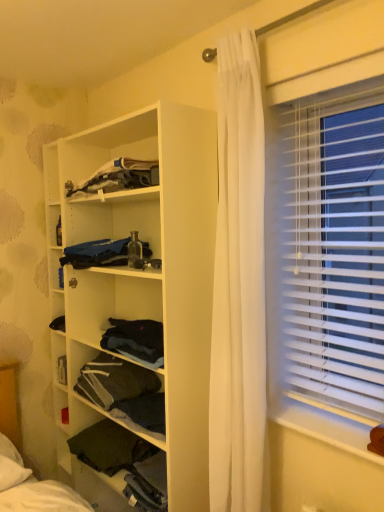
Question: Is white plastic window sill at lower right taller than dark fabric at lower left, which ranks as the 3th shelf in top-to-bottom order?

Choices:
 (A) yes
 (B) no

Answer: (B)

Question: Are white plastic window sill at lower right and dark fabric at lower left, the first shelf from the bottom, located far from each other?

Choices:
 (A) no
 (B) yes

Answer: (A)

Question: Can you confirm if white plastic window sill at lower right is positioned to the right of dark fabric at lower left, the first shelf from the bottom?

Choices:
 (A) no
 (B) yes

Answer: (B)

Question: Is white plastic window sill at lower right facing away from dark fabric at lower left, the first shelf from the bottom?

Choices:
 (A) no
 (B) yes

Answer: (A)

Question: Does white plastic window sill at lower right have a lesser width compared to dark fabric at lower left, which ranks as the 3th shelf in top-to-bottom order?

Choices:
 (A) yes
 (B) no

Answer: (A)

Question: Based on their sizes in the image, would you say white matte wooden shelf at center, which is the 1th shelf from top to bottom, is bigger or smaller than dark fabric at lower left, the first shelf from the bottom?

Choices:
 (A) big
 (B) small

Answer: (A)

Question: Is white matte wooden shelf at center, which is the 1th shelf from top to bottom, wider or thinner than dark fabric at lower left, which ranks as the 3th shelf in top-to-bottom order?

Choices:
 (A) thin
 (B) wide

Answer: (A)

Question: Visually, is white matte wooden shelf at center, which is the 1th shelf from top to bottom, positioned to the left or to the right of dark fabric at lower left, the first shelf from the bottom?

Choices:
 (A) left
 (B) right

Answer: (B)

Question: Is point (213, 168) positioned closer to the camera than point (135, 437)?

Choices:
 (A) closer
 (B) farther

Answer: (A)

Question: Based on their sizes in the image, would you say dark fabric at lower left, which ranks as the 3th shelf in top-to-bottom order, is bigger or smaller than white plastic blinds at right?

Choices:
 (A) big
 (B) small

Answer: (B)

Question: From a real-world perspective, is dark fabric at lower left, which ranks as the 3th shelf in top-to-bottom order, physically located above or below white plastic blinds at right?

Choices:
 (A) above
 (B) below

Answer: (B)

Question: Looking at their shapes, would you say dark fabric at lower left, which ranks as the 3th shelf in top-to-bottom order, is wider or thinner than white plastic blinds at right?

Choices:
 (A) wide
 (B) thin

Answer: (A)

Question: In the image, is dark fabric at lower left, the first shelf from the bottom, on the left side or the right side of white plastic blinds at right?

Choices:
 (A) left
 (B) right

Answer: (A)

Question: In terms of width, does white plastic blinds at right look wider or thinner when compared to blue fabric at center, the 2th clothing in the top-to-bottom sequence?

Choices:
 (A) wide
 (B) thin

Answer: (B)

Question: From a real-world perspective, relative to blue fabric at center, the 2th clothing in the top-to-bottom sequence, is white plastic blinds at right vertically above or below?

Choices:
 (A) below
 (B) above

Answer: (B)